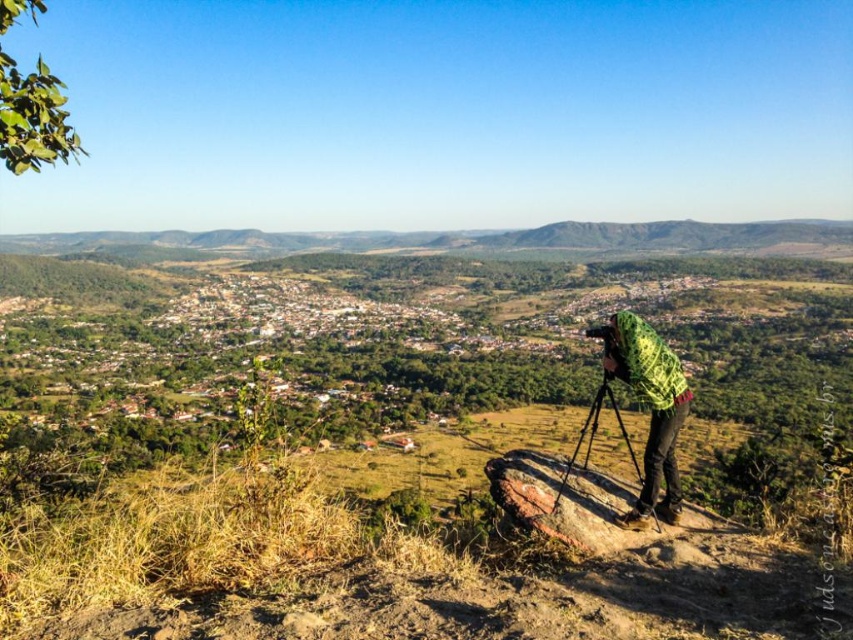
You are a photographer trying to decide whether to place a 30 cm wide camera bag between the green knitted sweater at center and the metallic tripod at center. Based on their widths, will the camera bag fit between them?

The green knitted sweater at center is narrower than the metallic tripod at center. Since the camera bag is 30 cm wide, and the combined width of both objects is not specified, it is unclear if there is enough space. However, since the sweater is narrower, there might be sufficient space between them for the camera bag to fit.

You are a photographer standing on the rocky outcrop. You need to adjust your camera setup. Which object, the green knitted sweater at center or the metallic tripod at center, is closer to your hands when you reach down from your current position?

The metallic tripod at center is closer to your hands because the green knitted sweater at center is located above it, meaning the tripod is below and thus within easier reach.

You are standing at the point labeled as point (618, 356) and want to take a photo of the landscape. There is a photographer at point (674, 504). Will the photographer be blocking your view of the landscape?

Point (674, 504) is in front of point (618, 356), so the photographer at point (674, 504) will block your view of the landscape.